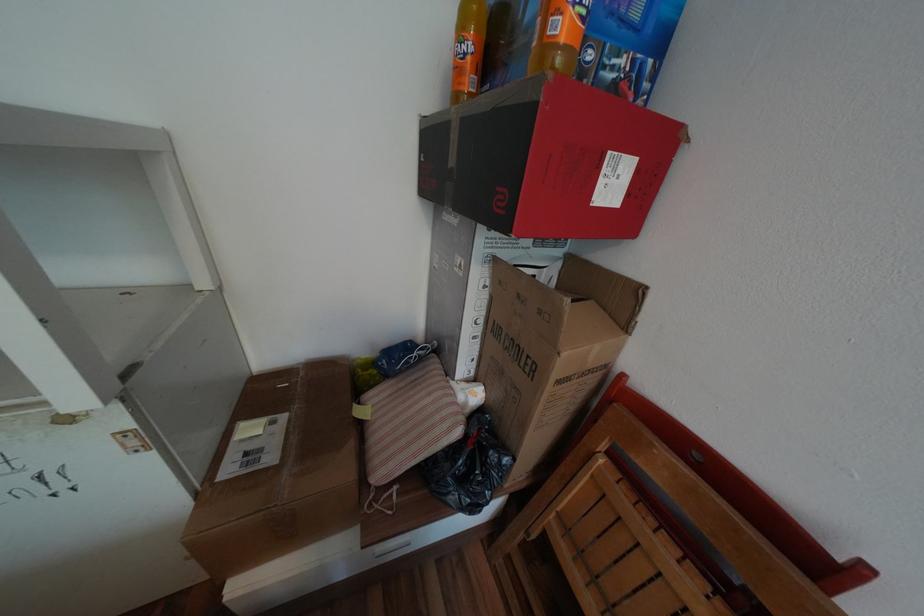
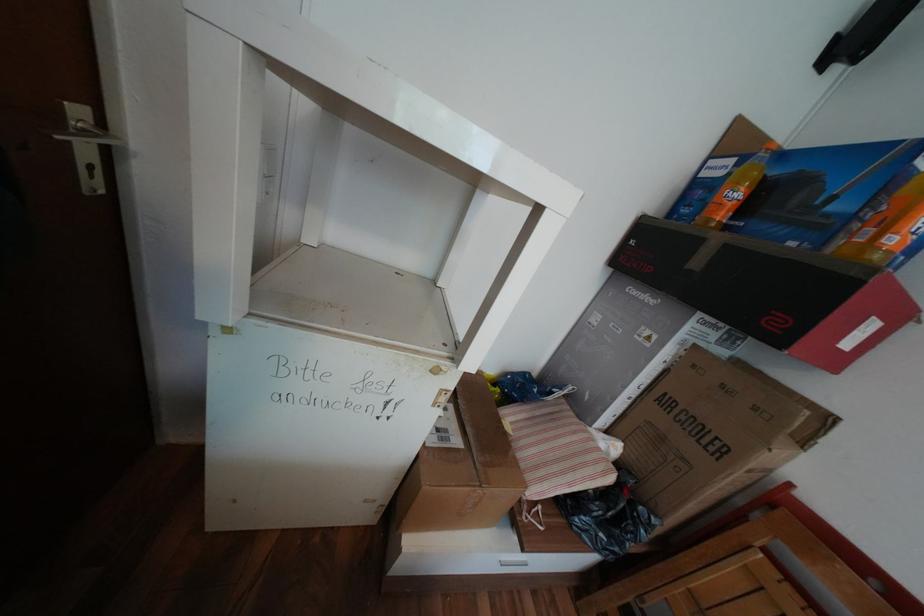
Question: Which direction would the cameraman need to move to produce the second image? Reply with the corresponding letter.

Choices:
 (A) Left
 (B) Right
 (C) Forward
 (D) Backward

Answer: (A)